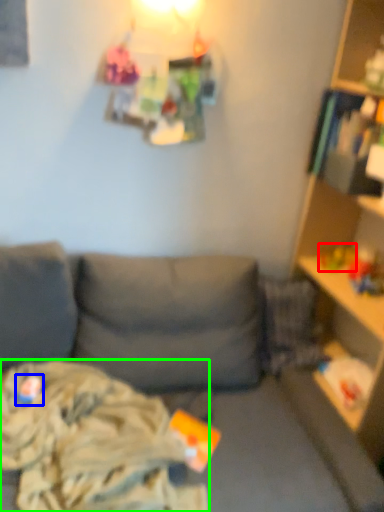
Question: Estimate the real-world distances between objects in this image. Which object is closer to toy (highlighted by a red box), toy (highlighted by a blue box) or clothing (highlighted by a green box)?

Choices:
 (A) toy
 (B) clothing

Answer: (B)